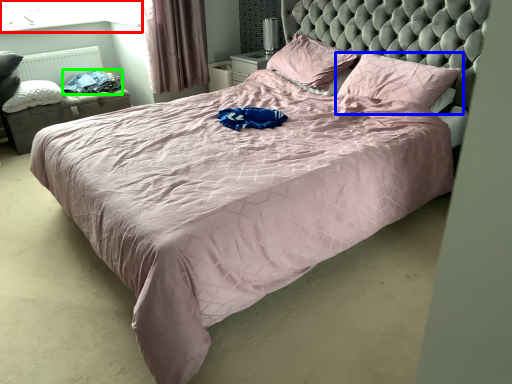
Question: Estimate the real-world distances between objects in this image. Which object is farther from window screen (highlighted by a red box), pillow (highlighted by a blue box) or clothing (highlighted by a green box)?

Choices:
 (A) pillow
 (B) clothing

Answer: (A)